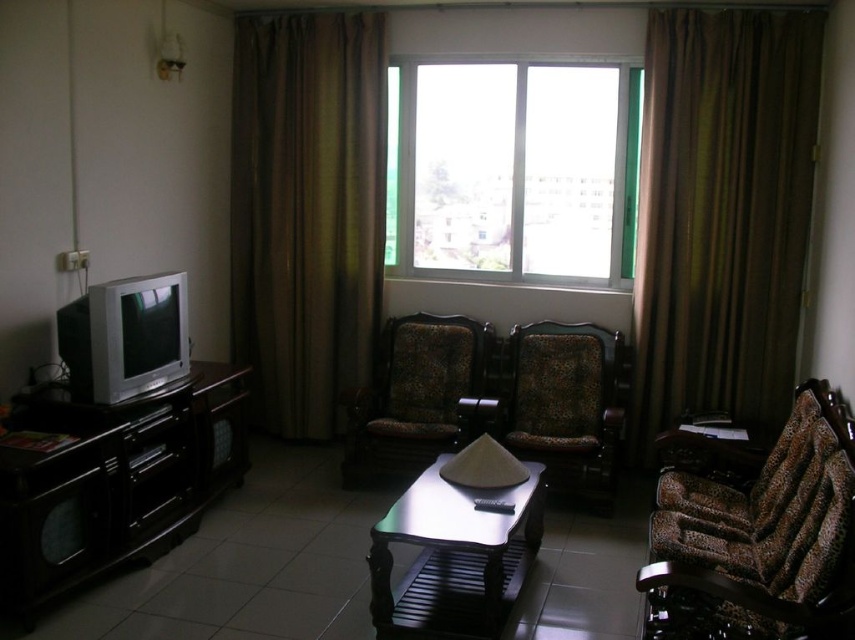
You are standing in the living room and want to hang a large painting that requires a tall space. Which object between the brown fabric curtain at right and the transparent glass window at center would be a better option for hanging the painting due to height?

The brown fabric curtain at right is taller than the transparent glass window at center, so it would be a better option for hanging the large painting as it provides more vertical space.